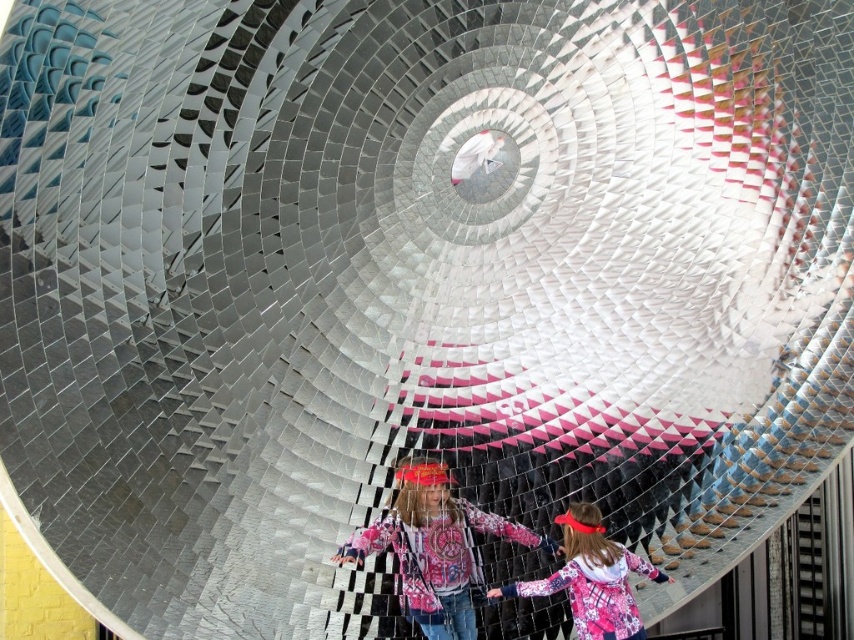
Can you confirm if plaid fabric shirt at center is shorter than plaid fabric hoodie at center?

In fact, plaid fabric shirt at center may be taller than plaid fabric hoodie at center.

What are the coordinates of `plaid fabric shirt at center` in the screenshot? It's located at (436, 548).